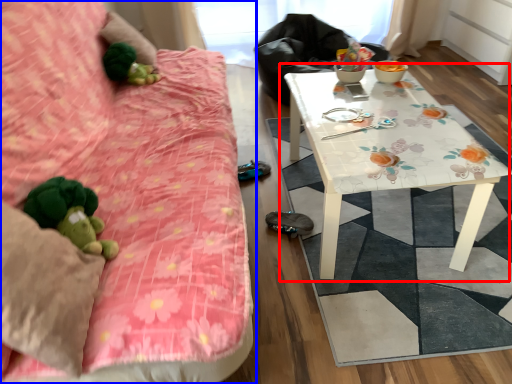
Question: Among these objects, which one is farthest to the camera, table (highlighted by a red box) or studio couch (highlighted by a blue box)?

Choices:
 (A) table
 (B) studio couch

Answer: (A)